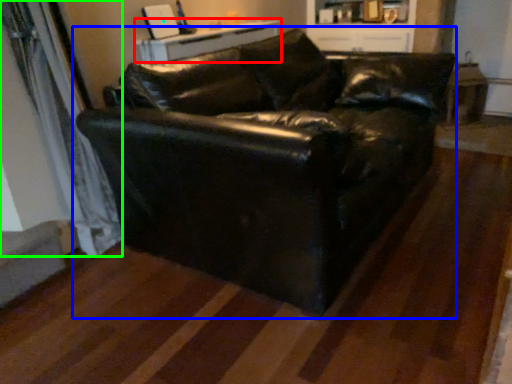
Question: Estimate the real-world distances between objects in this image. Which object is closer to table (highlighted by a red box), studio couch (highlighted by a blue box) or curtain (highlighted by a green box)?

Choices:
 (A) studio couch
 (B) curtain

Answer: (B)